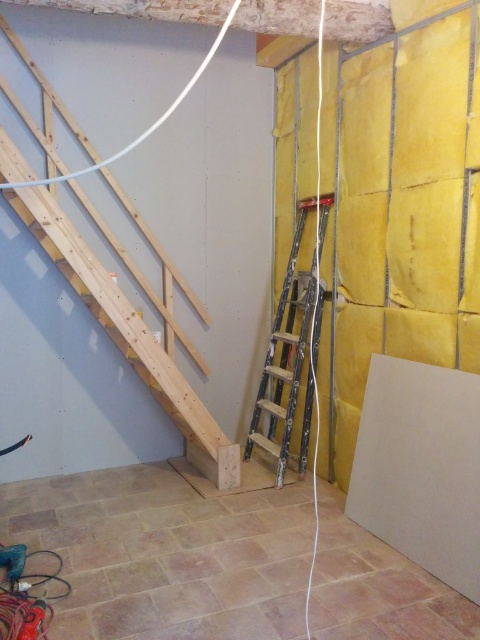
You are a delivery person trying to navigate through the construction site. You need to move a box from the beige tile floor at lower center to the natural wood stairs at left. Can you walk directly between them without any obstacles?

The beige tile floor at lower center and natural wood stairs at left are 97.08 centimeters apart from each other. Since this distance is narrow, it might be challenging to walk through directly with a box, but it is possible if you move carefully.

You are a worker needing to access the upper floor to install lighting fixtures. You see the natural wood stairs at left and the metallic silver ladder at center. Which object should you use to reach the upper floor safely?

The natural wood stairs at left should be used to reach the upper floor safely since they are positioned over the metallic silver ladder at center, indicating they are the proper staircase leading upwards.

You are a painter who needs to reach a high spot on the wall. You have a beige tile floor at lower center and a metallic silver ladder at center. How far apart are these two objects?

The beige tile floor at lower center and metallic silver ladder at center are 3.46 feet apart.